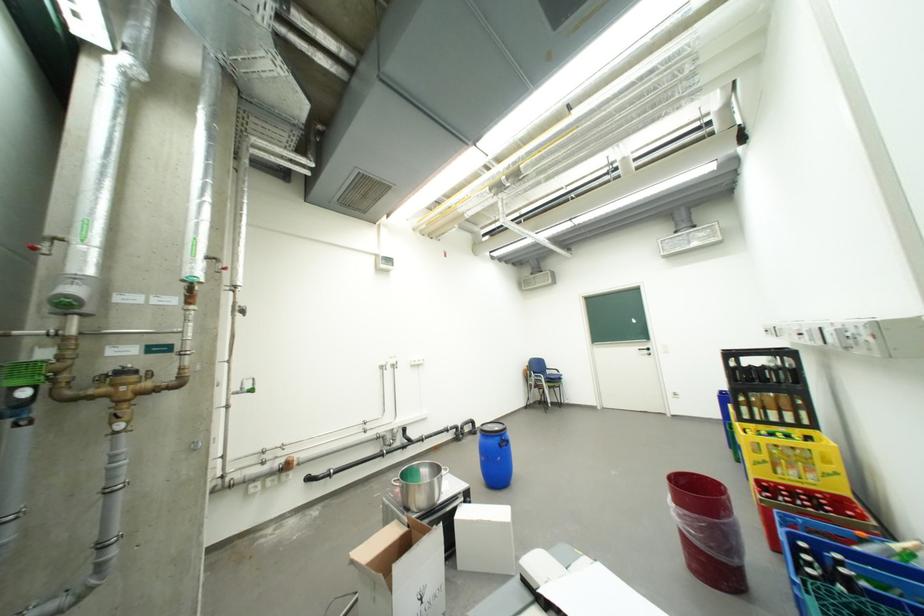
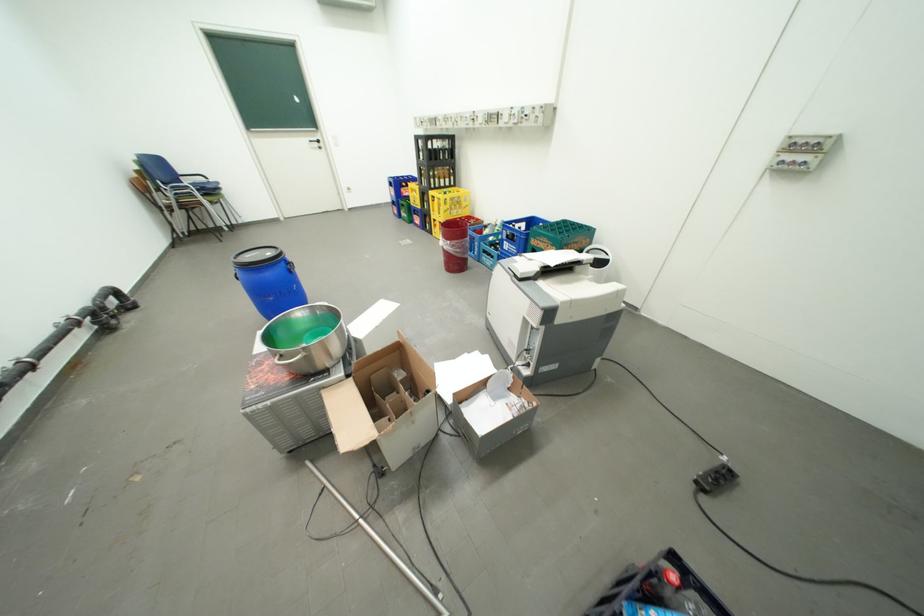
Where in the second image is the point corresponding to (x=685, y=507) from the first image?

(459, 243)